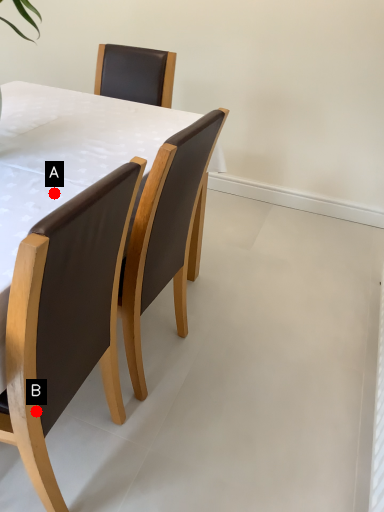
Question: Two points are circled on the image, labeled by A and B beside each circle. Which point appears farthest from the camera in this image?

Choices:
 (A) A is further
 (B) B is further

Answer: (A)